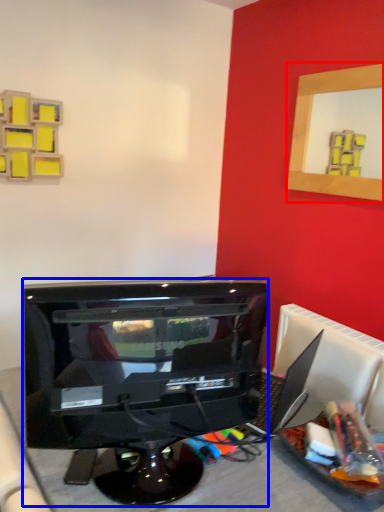
Question: Which object is closer to the camera taking this photo, picture frame (highlighted by a red box) or computer monitor (highlighted by a blue box)?

Choices:
 (A) picture frame
 (B) computer monitor

Answer: (B)